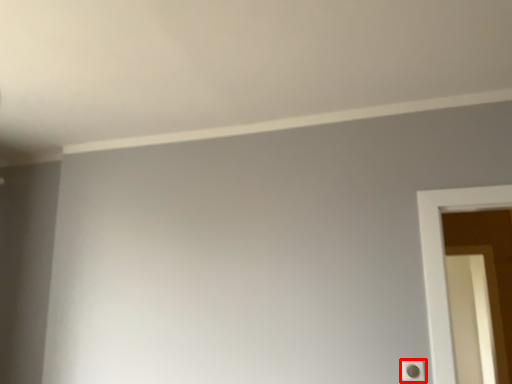
Question: From the image's perspective, where is light switch (annotated by the red box) located in relation to screen door in the image?

Choices:
 (A) below
 (B) above

Answer: (B)